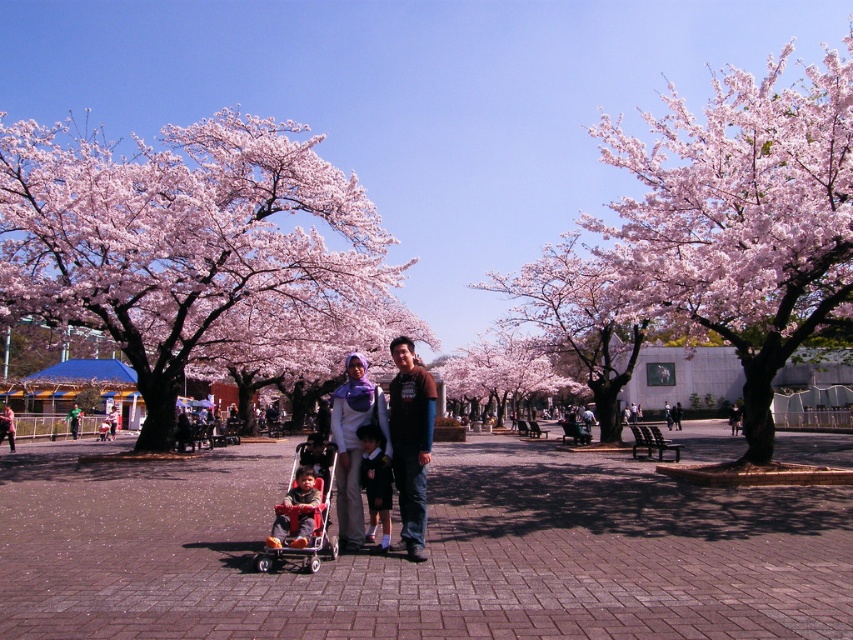
Question: Is pink blossom tree at center to the right of matte red stroller at lower left from the viewer's perspective?

Choices:
 (A) yes
 (B) no

Answer: (A)

Question: Which point is farther to the camera?

Choices:
 (A) brown cotton shirt at center
 (B) red plastic baby carriage at center

Answer: (A)

Question: Is red plastic baby carriage at center closer to camera compared to matte red stroller at lower left?

Choices:
 (A) no
 (B) yes

Answer: (B)

Question: Estimate the real-world distances between objects in this image. Which object is closer to the brown cotton shirt at center?

Choices:
 (A) pink blossom tree at center
 (B) pink blossoming tree at center

Answer: (B)

Question: Estimate the real-world distances between objects in this image. Which object is farther from the matte white hijab at center?

Choices:
 (A) pink blossoming tree at center
 (B) red plastic baby carriage at center

Answer: (A)

Question: Can you confirm if brown cotton shirt at center is positioned below red plastic baby carriage at center?

Choices:
 (A) no
 (B) yes

Answer: (A)